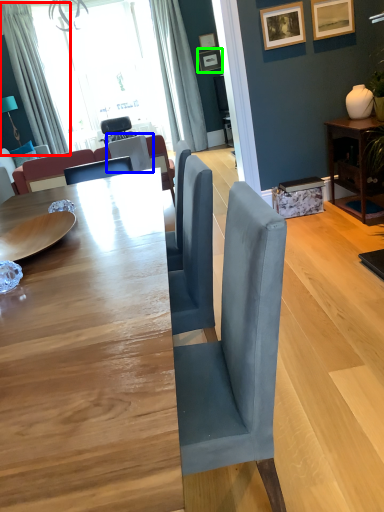
Question: Based on their relative distances, which object is nearer to curtain (highlighted by a red box)? Choose from chair (highlighted by a blue box) and picture frame (highlighted by a green box).

Choices:
 (A) chair
 (B) picture frame

Answer: (A)